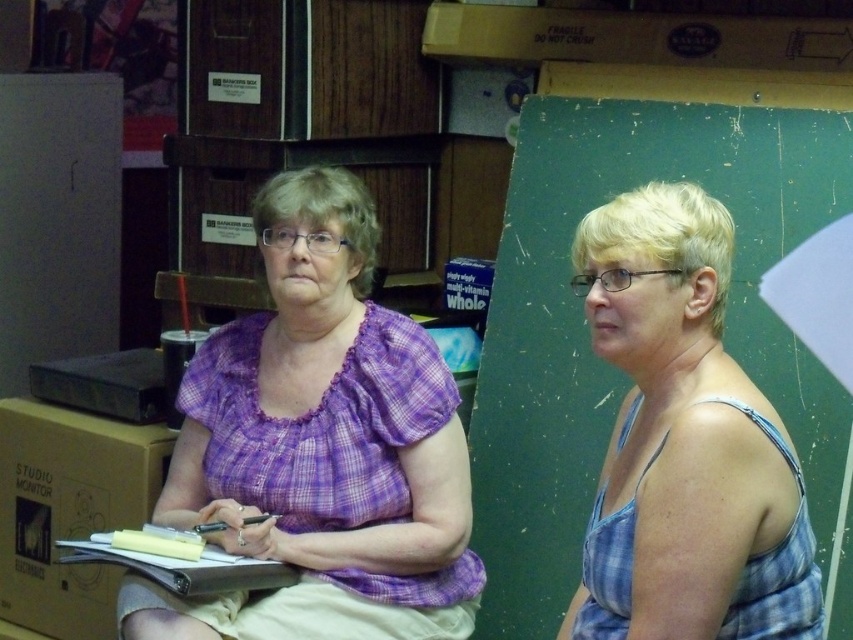
Question: Which object is closer to the camera taking this photo?

Choices:
 (A) blue plaid tank top at right
 (B) brown cardboard box at left

Answer: (A)

Question: Which point is farther from the camera taking this photo?

Choices:
 (A) (244, 573)
 (B) (82, 472)

Answer: (B)

Question: Can you confirm if purple plaid blouse at center is positioned below blue plaid tank top at right?

Choices:
 (A) yes
 (B) no

Answer: (B)

Question: Which of the following is the closest to the observer?

Choices:
 (A) brown cardboard box at left
 (B) blue plaid tank top at right
 (C) purple plaid blouse at center
 (D) white paper at center

Answer: (B)

Question: Can you confirm if purple plaid blouse at center is smaller than white paper at center?

Choices:
 (A) no
 (B) yes

Answer: (A)

Question: Can you confirm if purple plaid blouse at center is bigger than white paper at center?

Choices:
 (A) yes
 (B) no

Answer: (A)